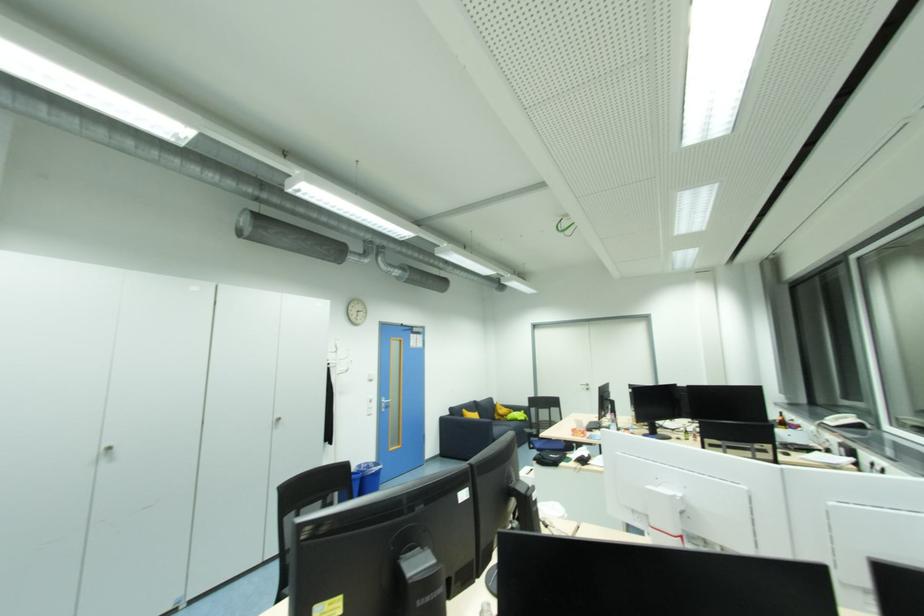
Find the location of a particular element. This screenshot has width=924, height=616. yellow pillow is located at coordinates (520, 415).